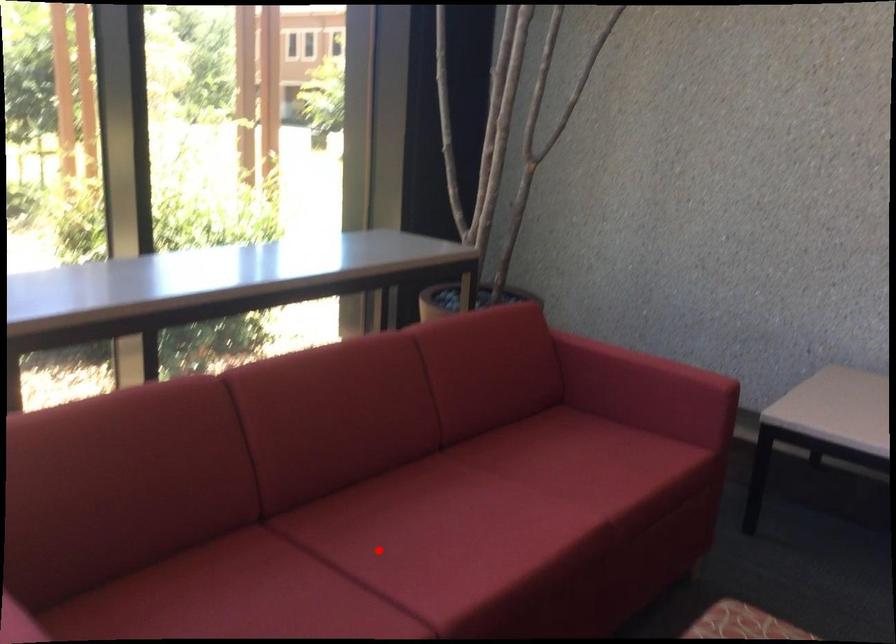
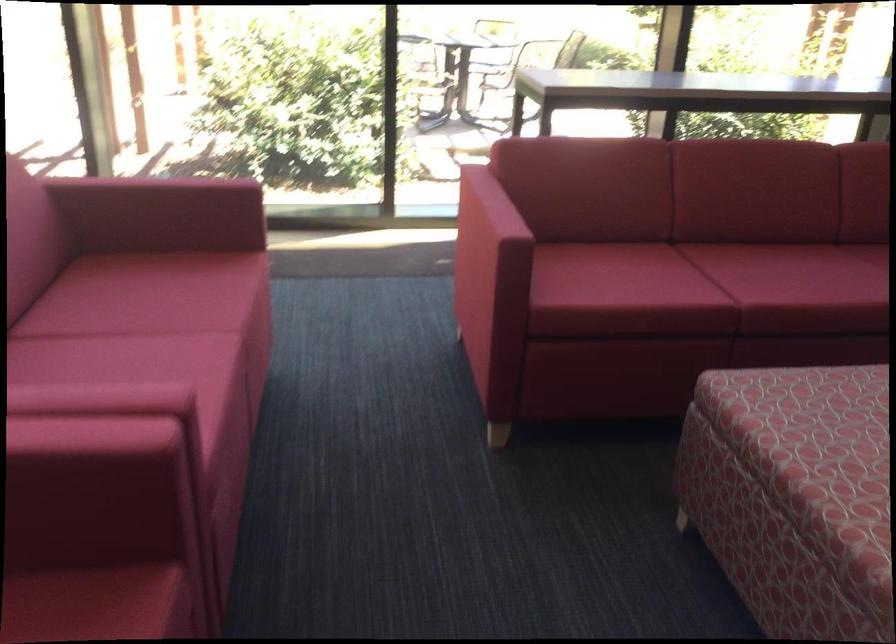
The point at the highlighted location is marked in the first image. Where is the corresponding point in the second image?

(728, 269)